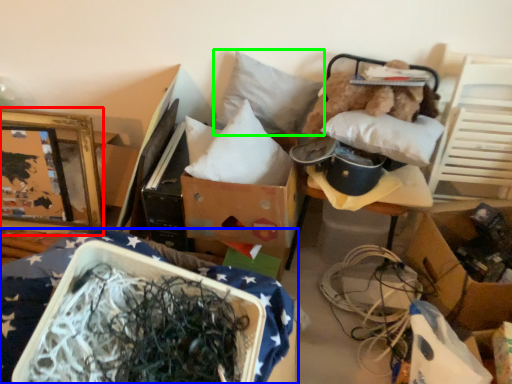
Question: Which is nearer to the picture frame (highlighted by a red box)? furniture (highlighted by a blue box) or pillow (highlighted by a green box).

Choices:
 (A) furniture
 (B) pillow

Answer: (B)